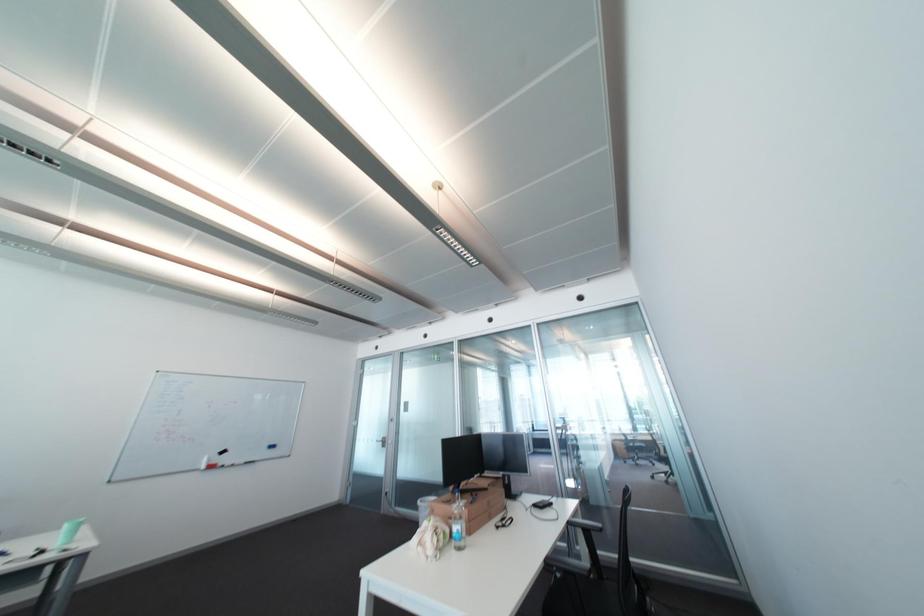
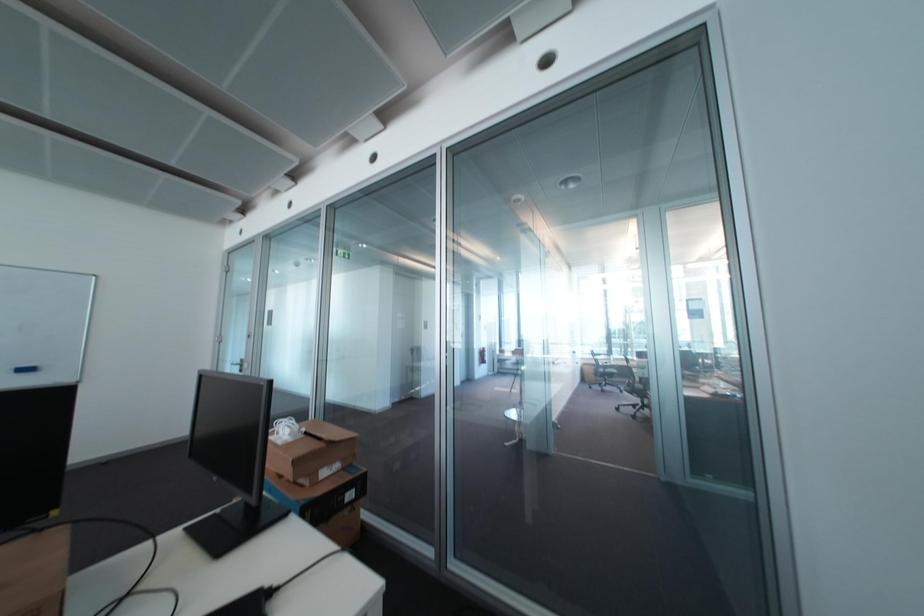
Which direction would the cameraman need to move to produce the second image?

The movement direction of the cameraman is right, forward.